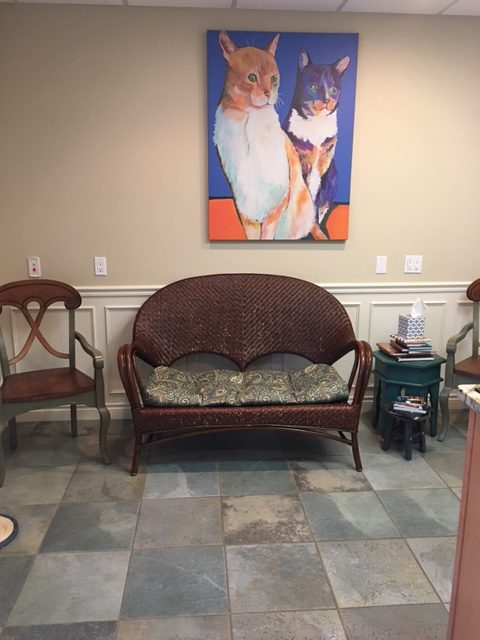
What are the coordinates of `rug` in the screenshot? It's located at tap(12, 525).